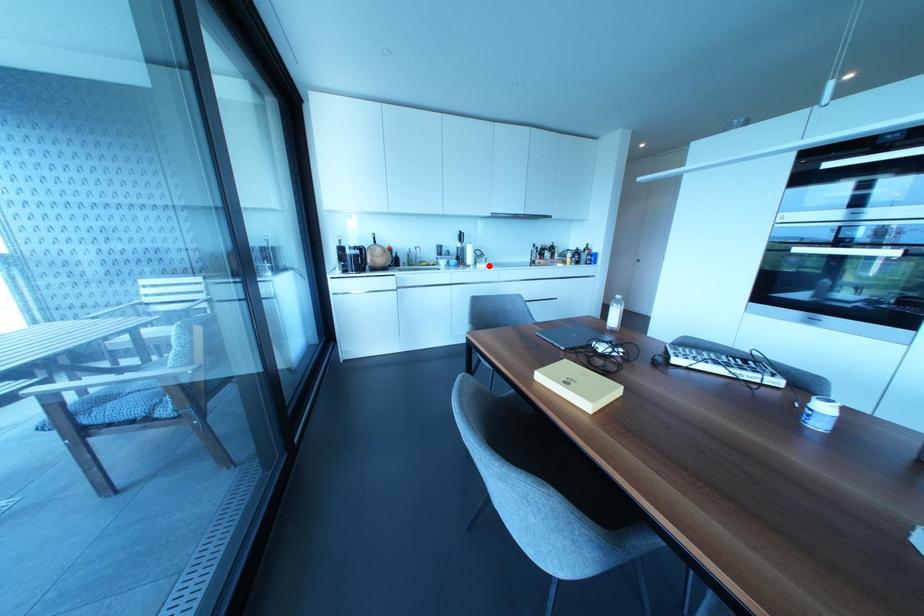
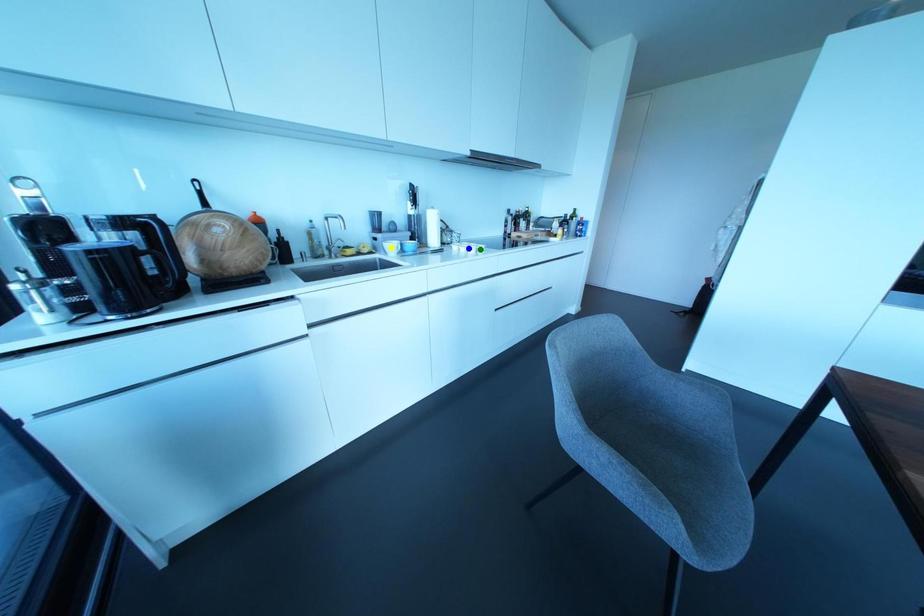
Question: I am providing you with two images of the same scene from different viewpoints. A red point is marked on the first image. You are given multiple points on the second image. Which point in image 2 is actually the same real-world point as the red point in image 1?

Choices:
 (A) green point
 (B) blue point
 (C) yellow point

Answer: (A)